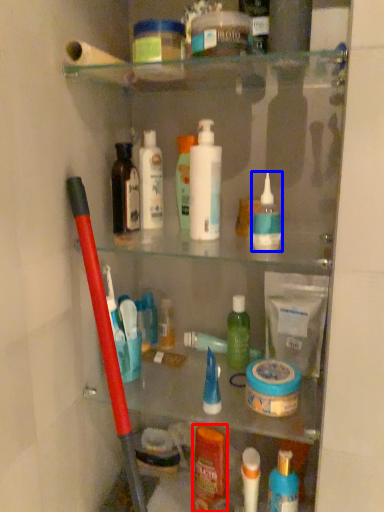
Question: Among these objects, which one is farthest to the camera, toiletry (highlighted by a red box) or toiletry (highlighted by a blue box)?

Choices:
 (A) toiletry
 (B) toiletry

Answer: (A)